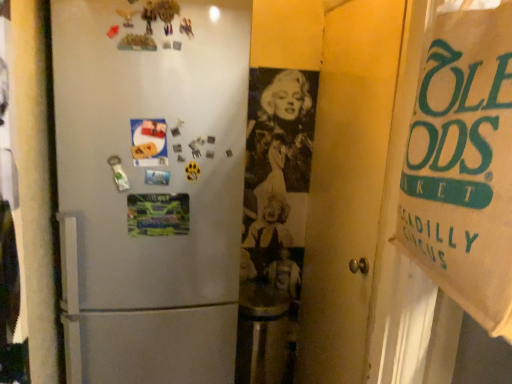
Question: Can brown paper bag at right be found inside multicolored paper at center, which is counted as the second postcard, starting from the top?

Choices:
 (A) yes
 (B) no

Answer: (B)

Question: Is multicolored paper at center, which is the 1th postcard in bottom-to-top order, to the left of brown paper bag at right from the viewer's perspective?

Choices:
 (A) yes
 (B) no

Answer: (A)

Question: Is multicolored paper at center, which is counted as the second postcard, starting from the top, to the right of brown paper bag at right from the viewer's perspective?

Choices:
 (A) no
 (B) yes

Answer: (A)

Question: Is multicolored paper at center, which is counted as the second postcard, starting from the top, bigger than brown paper bag at right?

Choices:
 (A) no
 (B) yes

Answer: (A)

Question: Is multicolored paper at center, which is counted as the second postcard, starting from the top, turned away from brown paper bag at right?

Choices:
 (A) no
 (B) yes

Answer: (A)

Question: From the image's perspective, is multicolored paper at center, which is counted as the second postcard, starting from the top, on top of brown paper bag at right?

Choices:
 (A) no
 (B) yes

Answer: (A)

Question: Is multicolored paper at center, which is counted as the second postcard, starting from the top, at the right side of matte paper postcard at center left, arranged as the 1th postcard when viewed from the top?

Choices:
 (A) yes
 (B) no

Answer: (A)

Question: Is multicolored paper at center, which is counted as the second postcard, starting from the top, located outside matte paper postcard at center left, the second postcard positioned from the bottom?

Choices:
 (A) no
 (B) yes

Answer: (B)

Question: From a real-world perspective, is multicolored paper at center, which is counted as the second postcard, starting from the top, on matte paper postcard at center left, the second postcard positioned from the bottom?

Choices:
 (A) yes
 (B) no

Answer: (B)

Question: Is multicolored paper at center, which is the 1th postcard in bottom-to-top order, aimed at matte paper postcard at center left, the second postcard positioned from the bottom?

Choices:
 (A) yes
 (B) no

Answer: (B)

Question: Is multicolored paper at center, which is the 1th postcard in bottom-to-top order, smaller than matte paper postcard at center left, arranged as the 1th postcard when viewed from the top?

Choices:
 (A) no
 (B) yes

Answer: (A)

Question: From the image's perspective, is multicolored paper at center, which is counted as the second postcard, starting from the top, below matte paper postcard at center left, the second postcard positioned from the bottom?

Choices:
 (A) no
 (B) yes

Answer: (B)

Question: From the image's perspective, is brown paper bag at right above matte paper postcard at center left, arranged as the 1th postcard when viewed from the top?

Choices:
 (A) no
 (B) yes

Answer: (A)